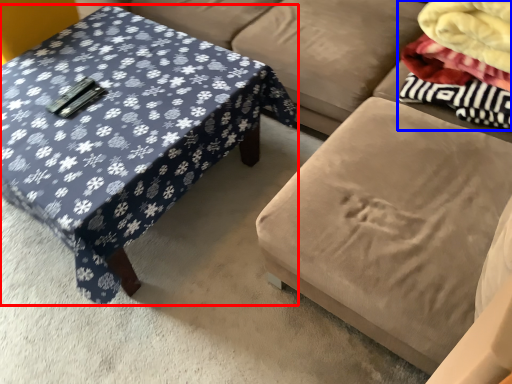
Question: Which of the following is the farthest to the observer, coffee table (highlighted by a red box) or fabric (highlighted by a blue box)?

Choices:
 (A) coffee table
 (B) fabric

Answer: (B)